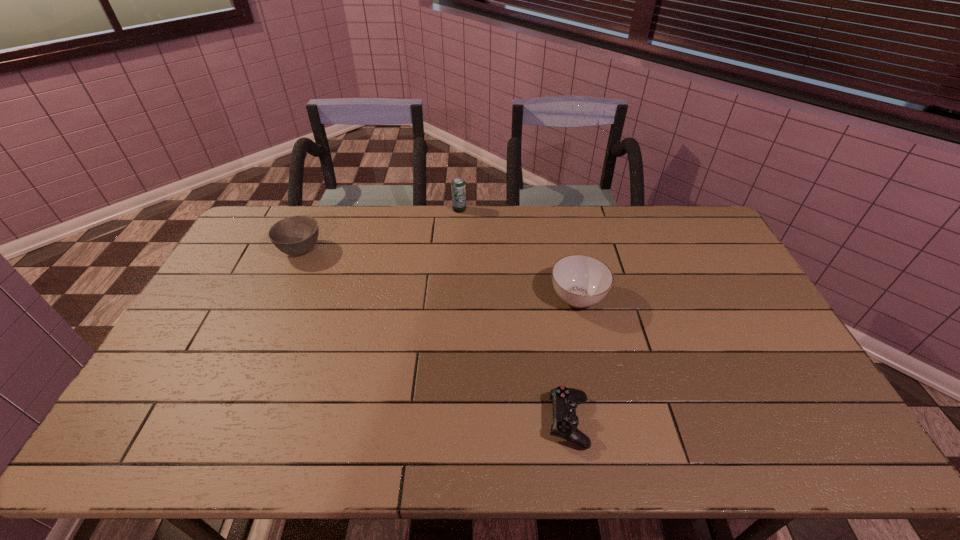
This screenshot has width=960, height=540. I want to click on vacant space that's between the farthest object and the nearest object, so click(514, 316).

You are a GUI agent. You are given a task and a screenshot of the screen. Output one action in this format:
    pyautogui.click(x=<x>, y=<y>)
    Task: Click on the free space between the third farthest object and the third nearest object
    
    Given the screenshot: What is the action you would take?
    pyautogui.click(x=439, y=274)

In order to click on free spot between the control and the bowl in this screenshot , I will do `click(435, 336)`.

The width and height of the screenshot is (960, 540). In order to click on empty location between the second object from left to right and the control in this screenshot , I will do `click(514, 316)`.

Image resolution: width=960 pixels, height=540 pixels. I want to click on free space that is in between the bowl and the control, so click(435, 336).

The width and height of the screenshot is (960, 540). Find the location of `vacant region between the chinaware and the tallest object`. vacant region between the chinaware and the tallest object is located at coordinates (518, 254).

This screenshot has height=540, width=960. I want to click on vacant area between the third farthest object and the second farthest object, so click(x=439, y=274).

At what (x,y) coordinates should I click in order to perform the action: click on vacant area that lies between the tallest object and the second farthest object. Please return your answer as a coordinate pair (x, y). The height and width of the screenshot is (540, 960). Looking at the image, I should click on (380, 230).

Find the location of `free space between the beer can and the nearest object`. free space between the beer can and the nearest object is located at coordinates (514, 316).

At what (x,y) coordinates should I click in order to perform the action: click on vacant space that's between the third object from right to left and the third farthest object. Please return your answer as a coordinate pair (x, y). The width and height of the screenshot is (960, 540). Looking at the image, I should click on (518, 254).